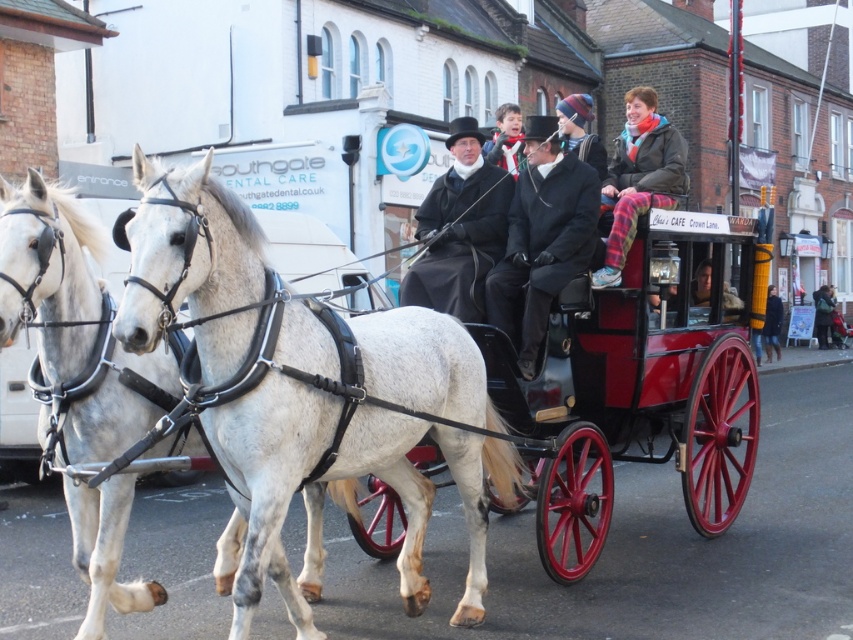
Question: Based on their relative distances, which object is farther from the white leather harness at left?

Choices:
 (A) multicolored knit hat at upper center
 (B) red polished wood horse cart at center
 (C) dark blue denim jacket at lower right
 (D) black leather coat at center

Answer: (C)

Question: Does black wool coat at center appear on the right side of matte black coat at center?

Choices:
 (A) yes
 (B) no

Answer: (B)

Question: Is flannel pajama pants at center to the right of multicolored knit hat at upper center from the viewer's perspective?

Choices:
 (A) no
 (B) yes

Answer: (B)

Question: Among these objects, which one is nearest to the camera?

Choices:
 (A) black leather coat at center
 (B) red polished wood horse cart at center

Answer: (B)

Question: Which object appears farthest from the camera in this image?

Choices:
 (A) dark green coat at center
 (B) black wool coat at center
 (C) dark blue denim jacket at lower right

Answer: (A)

Question: In this image, where is black leather coat at center located relative to dark blue denim jacket at lower right?

Choices:
 (A) left
 (B) right

Answer: (A)